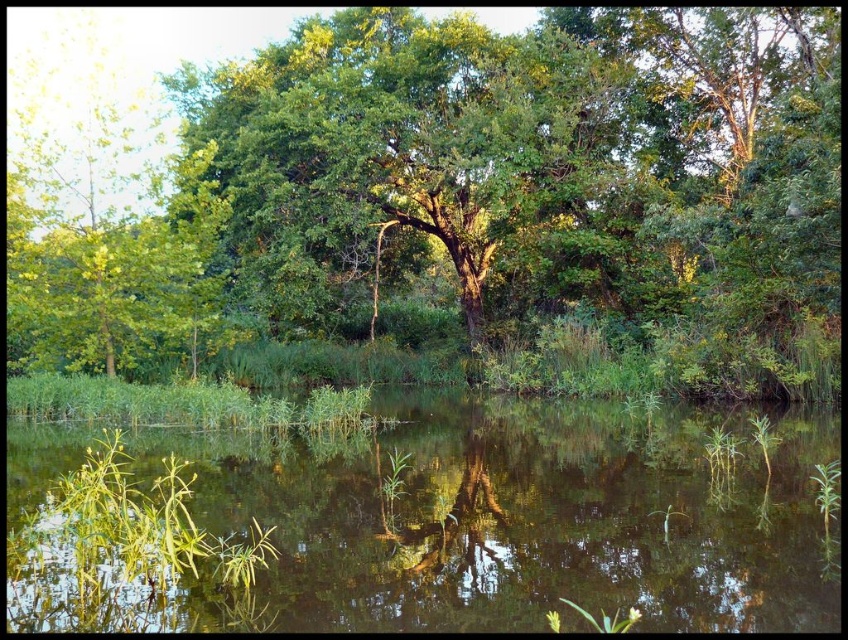
You are standing at the edge of the water and want to locate the green leafy tree at center. According to the coordinates provided, where would you find it?

The green leafy tree at center is located at coordinates point [452,189].

You are standing at the edge of the green grassy lake at center and want to reach the green leafy tree at center. Is the tree located above or below the lake?

The green leafy tree at center is above the green grassy lake at center, so the tree is located above the lake.